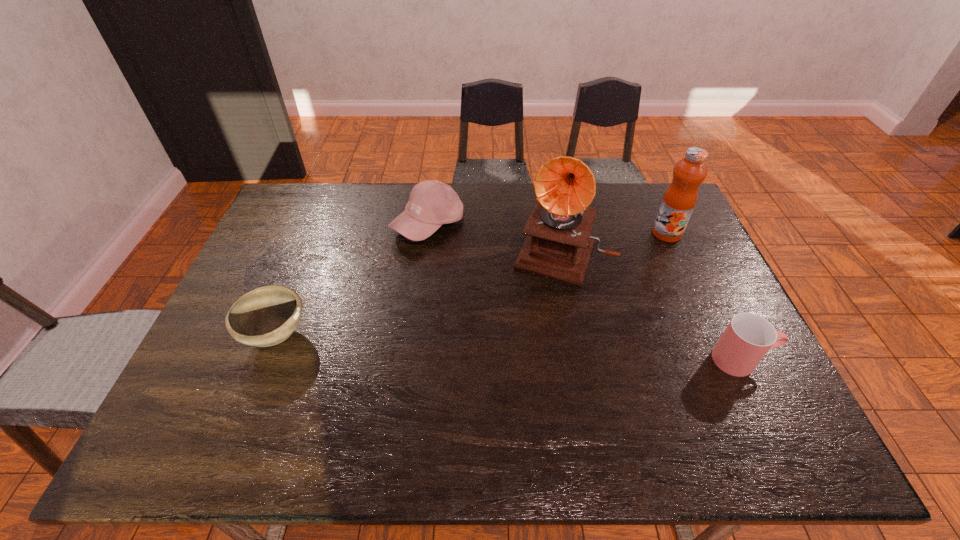
The width and height of the screenshot is (960, 540). In order to click on free space between the leftmost object and the cup in this screenshot , I will do `click(509, 348)`.

The image size is (960, 540). In order to click on vacant space that is in between the second object from left to right and the leftmost object in this screenshot , I will do `click(352, 280)`.

At what (x,y) coordinates should I click in order to perform the action: click on empty location between the cup and the tallest object. Please return your answer as a coordinate pair (x, y). Image resolution: width=960 pixels, height=540 pixels. Looking at the image, I should click on coord(652,307).

I want to click on free space between the fourth object from right to left and the tallest object, so click(x=494, y=239).

I want to click on free space between the third object from right to left and the cup, so click(x=652, y=307).

You are a GUI agent. You are given a task and a screenshot of the screen. Output one action in this format:
    pyautogui.click(x=<x>, y=<y>)
    Task: Click on the free space between the fourth shortest object and the cup
    The height and width of the screenshot is (540, 960).
    Given the screenshot: What is the action you would take?
    pyautogui.click(x=704, y=296)

The image size is (960, 540). I want to click on free spot between the cup and the bowl, so click(x=509, y=348).

I want to click on free spot between the cup and the baseball cap, so click(585, 292).

This screenshot has height=540, width=960. I want to click on empty space that is in between the phonograph record and the fruit juice, so tap(614, 244).

Point out which object is positioned as the third nearest to the fruit juice. Please provide its 2D coordinates. Your answer should be formatted as a tuple, i.e. [(x, y)], where the tuple contains the x and y coordinates of a point satisfying the conditions above.

[(432, 203)]